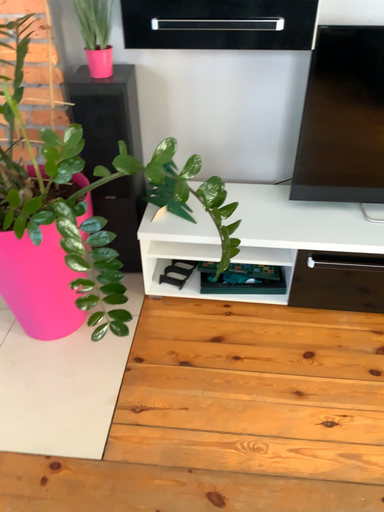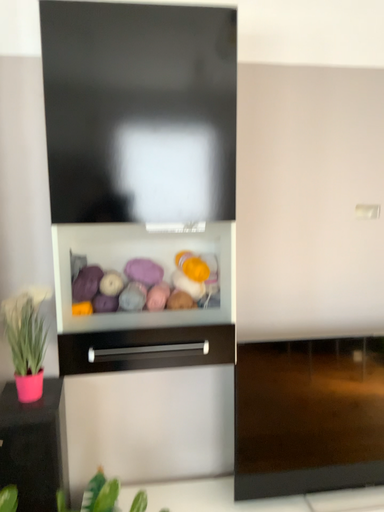
Question: Which way did the camera rotate in the video?

Choices:
 (A) rotated downward
 (B) rotated upward

Answer: (B)